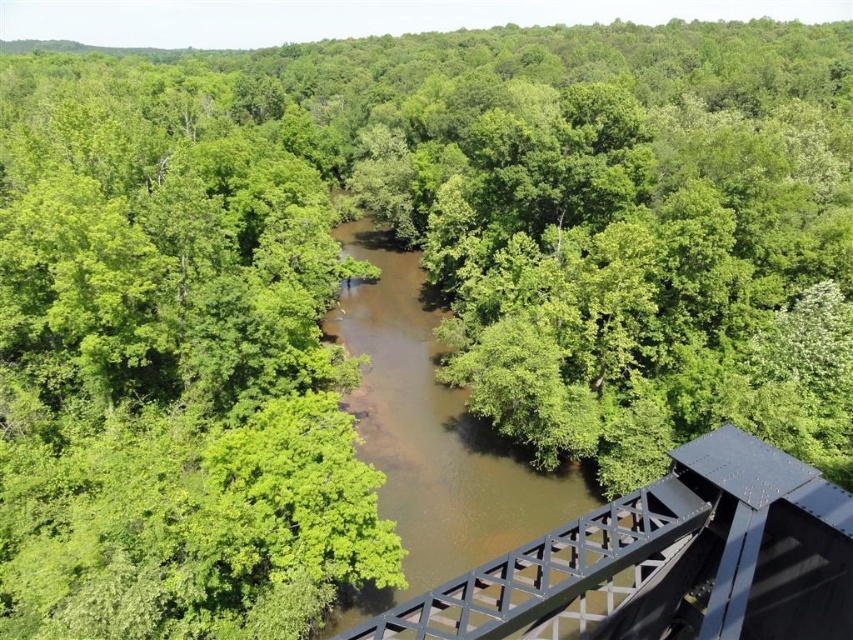
You are standing on the black metal train bridge at center and want to cross to the other side. Which direction should you walk to avoid stepping into the brown muddy water at center?

The black metal train bridge at center is positioned on the right side of brown muddy water at center. To avoid stepping into the brown muddy water at center, you should walk to the left side of the black metal train bridge at center.

You are a bird soaring above the forest. You want to land on the black metal train bridge at center but need to avoid the brown muddy water at center. Based on their heights, can you safely land on the bridge without getting wet?

The black metal train bridge at center has a lesser height compared to brown muddy water at center, meaning the water is higher than the bridge. Therefore, landing on the bridge might result in getting wet as the water level is above the bridge.

You are a hiker who wants to cross the river using the black metal train bridge at center. However, you notice the brown muddy water at center. Is the bridge currently passable?

The black metal train bridge at center is below brown muddy water at center, so the bridge is submerged under the water and not passable at this time.